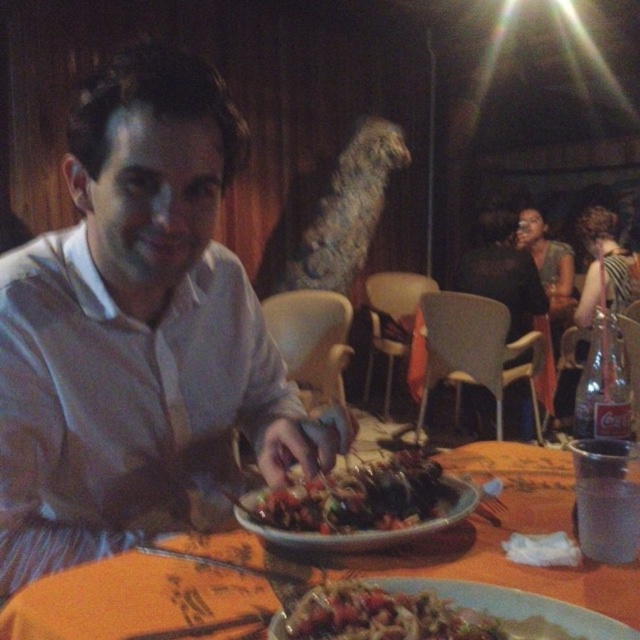
Can you confirm if slightly charred skewers at center is thinner than matte ceramic plate at center?

Yes, slightly charred skewers at center is thinner than matte ceramic plate at center.

This screenshot has height=640, width=640. Describe the element at coordinates (356, 497) in the screenshot. I see `slightly charred skewers at center` at that location.

Locate an element on the screen. The image size is (640, 640). slightly charred skewers at center is located at coordinates click(x=356, y=497).

Which is below, orange fabric table at center or slightly charred skewers at center?

orange fabric table at center is lower down.

Can you confirm if orange fabric table at center is positioned above slightly charred skewers at center?

No.

What do you see at coordinates (476, 538) in the screenshot? This screenshot has height=640, width=640. I see `orange fabric table at center` at bounding box center [476, 538].

Where is `orange fabric table at center`? orange fabric table at center is located at coordinates (476, 538).

Is point (83, 356) farther from viewer compared to point (88, 609)?

That is True.

Which is behind, point (173, 506) or point (483, 445)?

The point (483, 445) is more distant.

The height and width of the screenshot is (640, 640). In order to click on matte white shirt at center in this screenshot , I will do `click(138, 333)`.